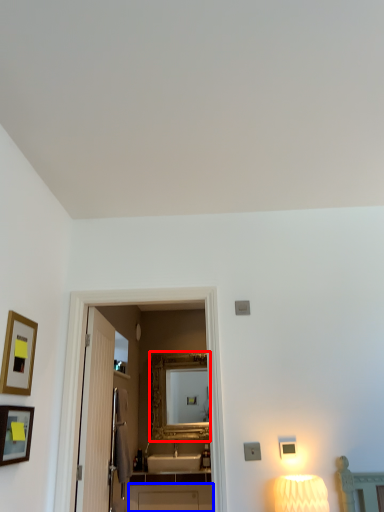
Question: Which object appears closest to the camera in this image, mirror (highlighted by a red box) or cabinetry (highlighted by a blue box)?

Choices:
 (A) mirror
 (B) cabinetry

Answer: (B)